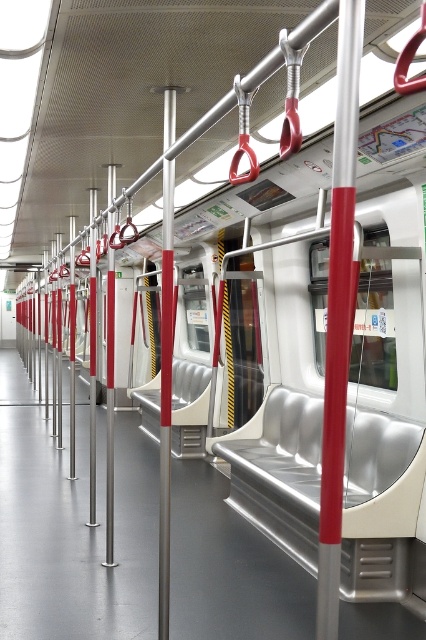
You are standing in the subway car and need to grab a handrail. You see the metallic red pole at center and the metallic silver pole at center. Which pole is located to the right when facing the direction of travel?

The metallic red pole at center is to the right of the metallic silver pole at center, so when facing the direction of travel, the metallic red pole at center is on the right side.

You are a passenger in the subway car and want to reach both the point at coordinate [328,557] and the point at coordinate [167,497]. Which point is closer to you?

The point at coordinate [328,557] is closer to you than the point at coordinate [167,497].